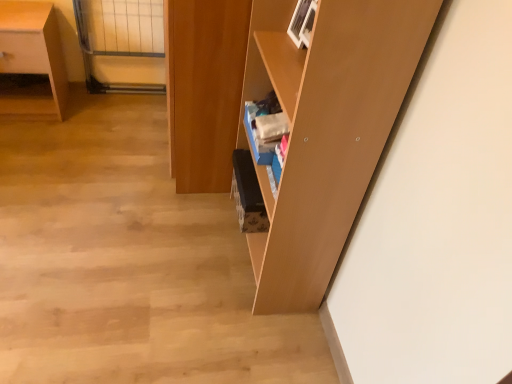
Find the location of a particular element. This screenshot has height=384, width=512. vacant region under clear glass door at upper left (from a real-world perspective) is located at coordinates (119, 95).